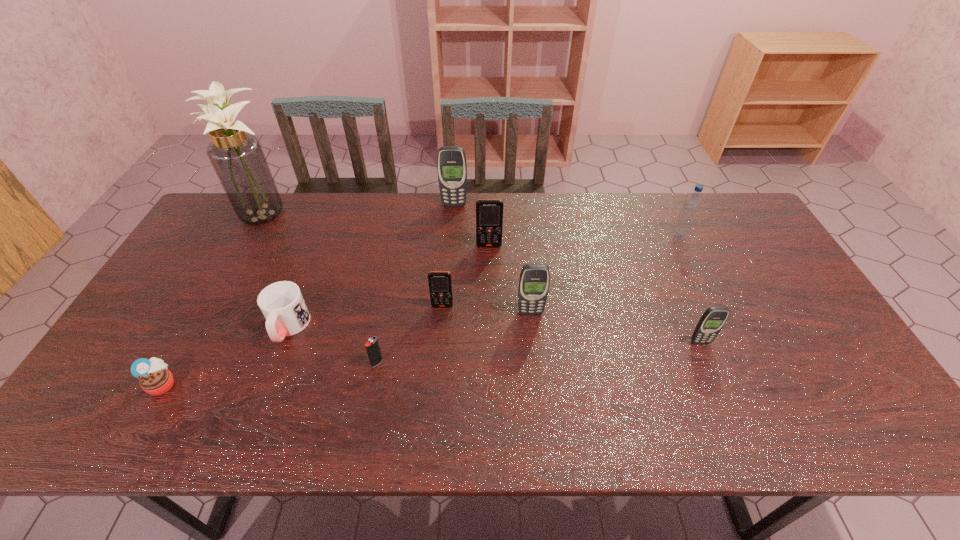
You are a GUI agent. You are given a task and a screenshot of the screen. Output one action in this format:
    pyautogui.click(x=<x>, y=<y>)
    Task: Click on the left orange cellular telephone
    This screenshot has height=540, width=960.
    Given the screenshot: What is the action you would take?
    pyautogui.click(x=440, y=283)

In order to click on the third farthest cellular telephone in this screenshot , I will do `click(440, 283)`.

Identify the location of the smallest gray cellular telephone. (712, 321).

Where is `the second object from right to left`? This screenshot has height=540, width=960. the second object from right to left is located at coordinates (712, 321).

Locate an element on the screen. the third object from left to right is located at coordinates (282, 304).

At what (x,y) coordinates should I click in order to perform the action: click on the second nearest object. Please return your answer as a coordinate pair (x, y). The height and width of the screenshot is (540, 960). Looking at the image, I should click on (372, 346).

I want to click on the fourth object from left to right, so click(372, 346).

Where is `muffin`? The height and width of the screenshot is (540, 960). muffin is located at coordinates (155, 379).

This screenshot has height=540, width=960. I want to click on pink muffin, so click(x=155, y=379).

Identify the location of free space located on the right of the tallest object. The width and height of the screenshot is (960, 540). (331, 213).